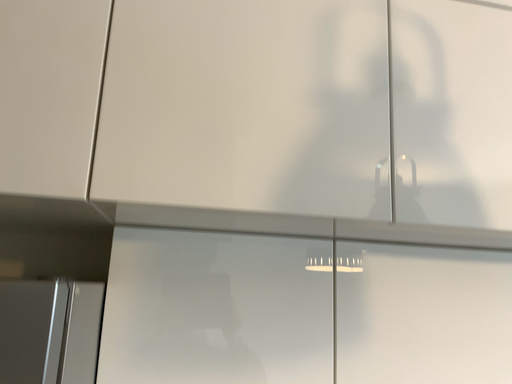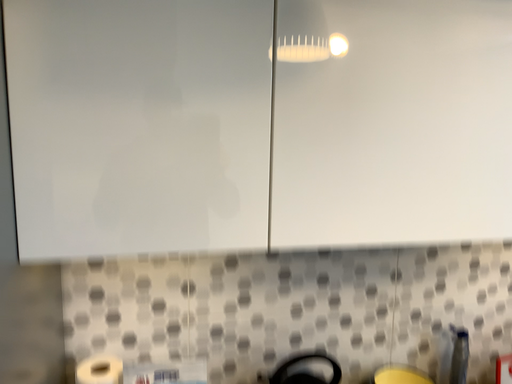
Question: Which way did the camera rotate in the video?

Choices:
 (A) rotated downward
 (B) rotated upward

Answer: (A)